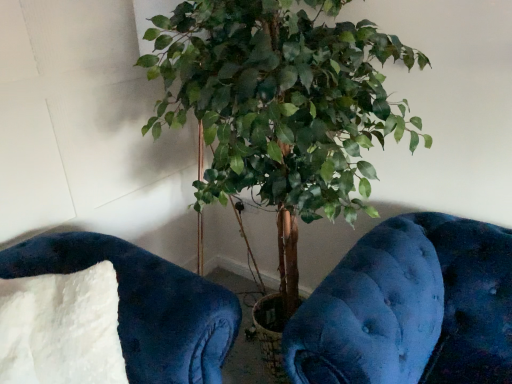
Question: Is green leafy plant at center in front of or behind white fluffy pillow at lower left in the image?

Choices:
 (A) behind
 (B) front

Answer: (B)

Question: Considering the positions of green leafy plant at center and white fluffy pillow at lower left in the image, is green leafy plant at center taller or shorter than white fluffy pillow at lower left?

Choices:
 (A) tall
 (B) short

Answer: (A)

Question: Which is farther from the velvety blue cushion at lower left?

Choices:
 (A) white fluffy pillow at lower left
 (B) green leafy plant at center

Answer: (B)

Question: Based on their relative distances, which object is nearer to the white fluffy pillow at lower left?

Choices:
 (A) velvety blue cushion at lower left
 (B) green leafy plant at center

Answer: (A)